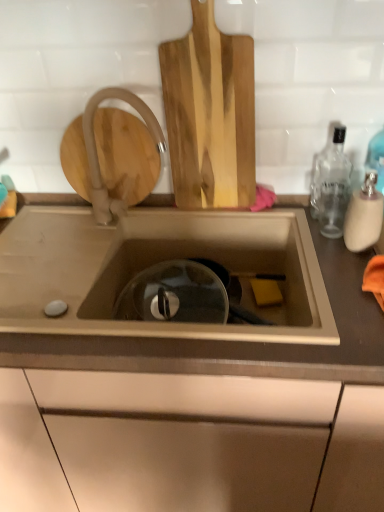
Locate an element on the screen. Image resolution: width=384 pixels, height=512 pixels. vacant space that is to the left of clear glass bottle at right, acting as the 2th bottle starting from the front is located at coordinates (286, 214).